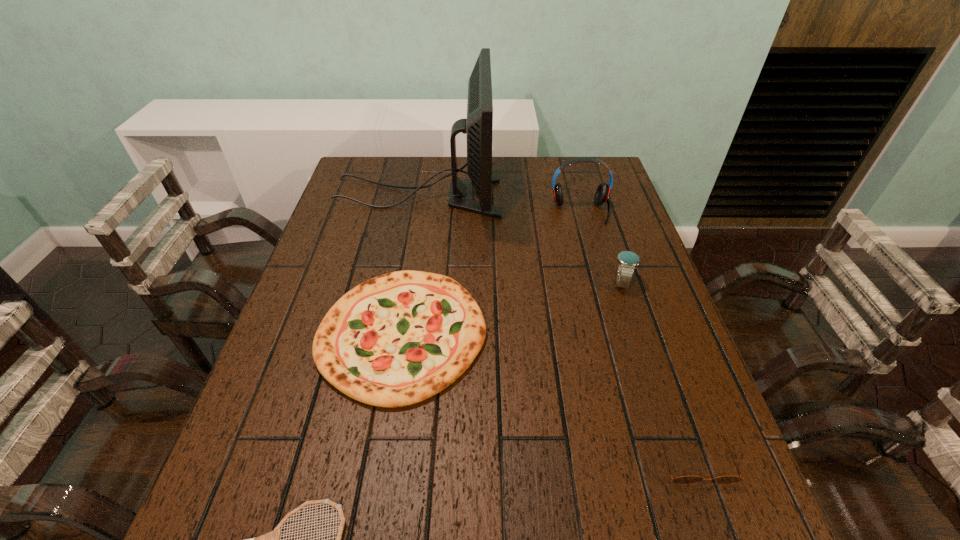
Identify which object is located as the fourth nearest to the third tallest object. Please provide its 2D coordinates. Your answer should be formatted as a tuple, i.e. [(x, y)], where the tuple contains the x and y coordinates of a point satisfying the conditions above.

[(684, 479)]

Identify which object is the fifth closest to the headset. Please provide its 2D coordinates. Your answer should be formatted as a tuple, i.e. [(x, y)], where the tuple contains the x and y coordinates of a point satisfying the conditions above.

[(271, 539)]

Identify the location of vacant point that satisfies the following two spatial constraints: 1. on the screen side of the computer monitor; 2. on the left side of the pizza. (394, 334).